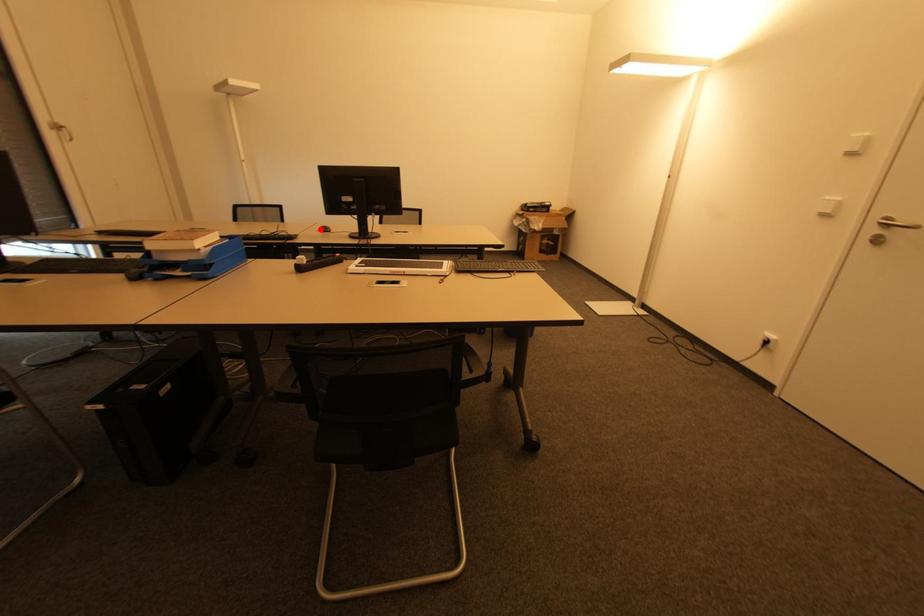
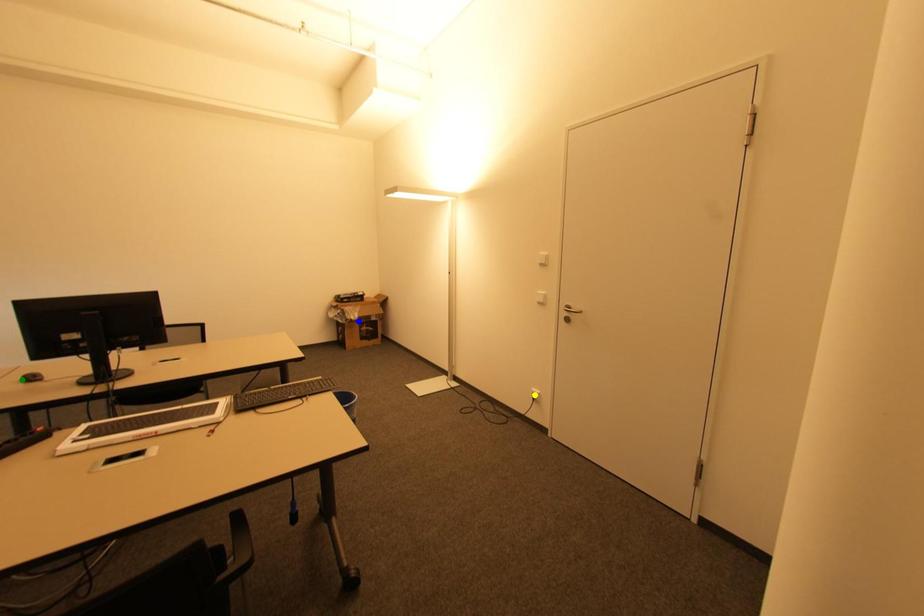
Question: I am providing you with two images of the same scene from different viewpoints. A red point is marked on the first image. You are given multiple points on the second image. Which point in image 2 represents the same 3d spot as the red point in image 1?

Choices:
 (A) green point
 (B) blue point
 (C) yellow point

Answer: (A)